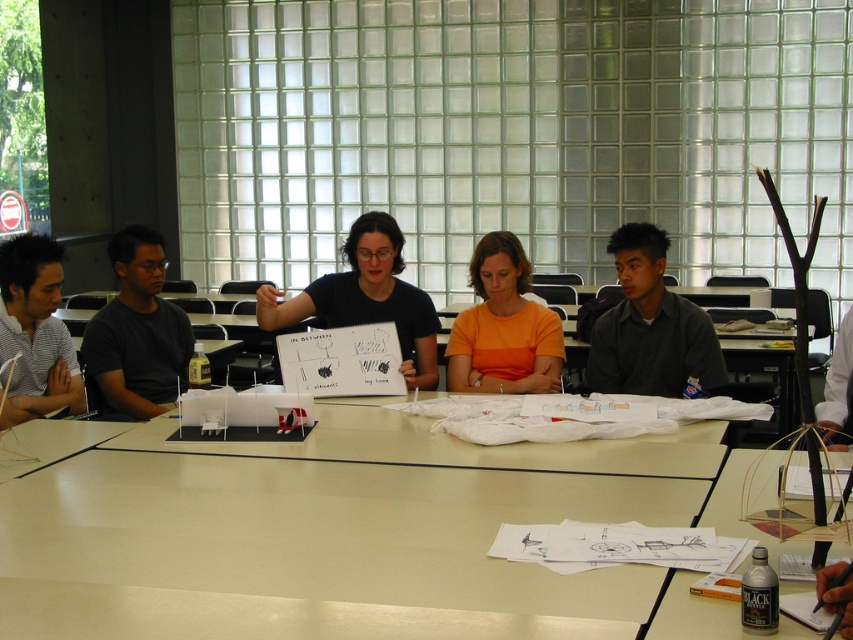
You are standing at point (650,625) and want to walk to the door located at point (518,362). Is there a clear path between these two points?

Point (518,362) is behind point (650,625), so you cannot directly walk to it from your current position.

You are standing in the classroom and need to locate the person wearing the black matte shirt at left. Can you tell me where exactly this person is positioned relative to the room?

The black matte shirt at left is located at the coordinates point (137, 332) in the room.

You are a person standing at the white glossy table at center and want to hand a document to the person wearing the black matte shirt at left. Considering your arm length is 2.5 feet, can you reach them without moving from your current position?

The distance between the white glossy table at center and the black matte shirt at left is 3.94 feet. Since your arm length is 2.5 feet, you cannot reach them without moving from your current position.